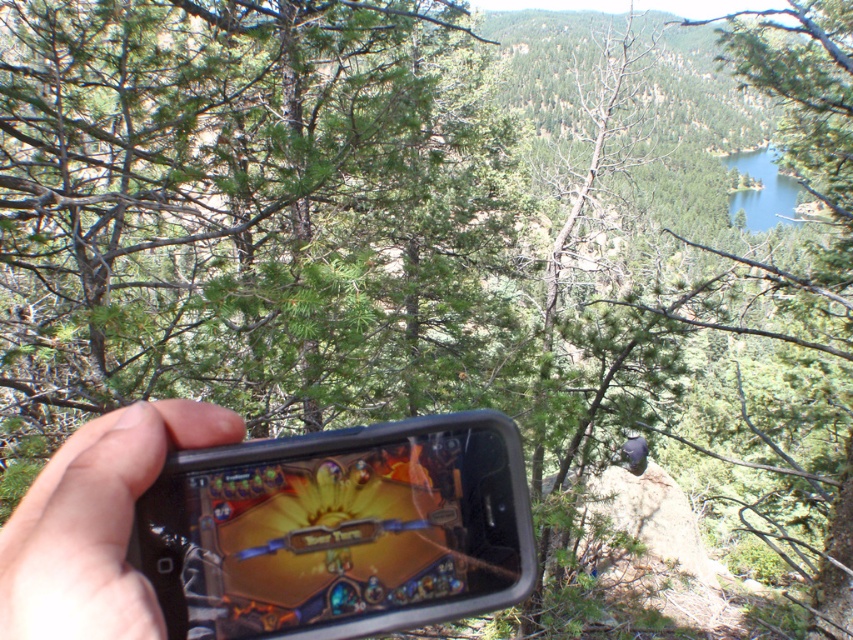
Can you confirm if black plastic smartphone at center is bigger than black matte phone at lower left?

Indeed, black plastic smartphone at center has a larger size compared to black matte phone at lower left.

Is black plastic smartphone at center taller than black matte phone at lower left?

Correct, black plastic smartphone at center is much taller as black matte phone at lower left.

Identify the location of black plastic smartphone at center. (339, 529).